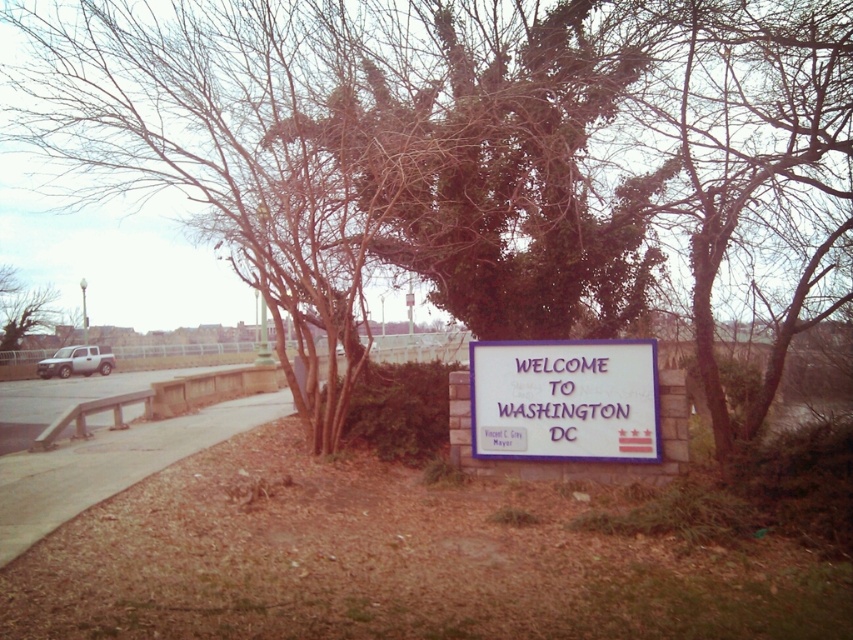
Question: Does white matte sign at center appear on the right side of brown concrete sidewalk at lower left?

Choices:
 (A) yes
 (B) no

Answer: (A)

Question: Which of the following is the farthest from the observer?

Choices:
 (A) (515, 397)
 (B) (196, 412)
 (C) (15, 280)

Answer: (C)

Question: From the image, what is the correct spatial relationship of brown concrete sidewalk at lower left in relation to green leafy tree at left?

Choices:
 (A) right
 (B) left

Answer: (A)

Question: Which point is farther to the camera?

Choices:
 (A) (35, 330)
 (B) (595, 406)

Answer: (A)

Question: Which point is closer to the camera?

Choices:
 (A) white matte sign at center
 (B) green leafy tree at left

Answer: (A)

Question: Can you confirm if brown concrete sidewalk at lower left is positioned to the right of green leafy tree at left?

Choices:
 (A) yes
 (B) no

Answer: (A)